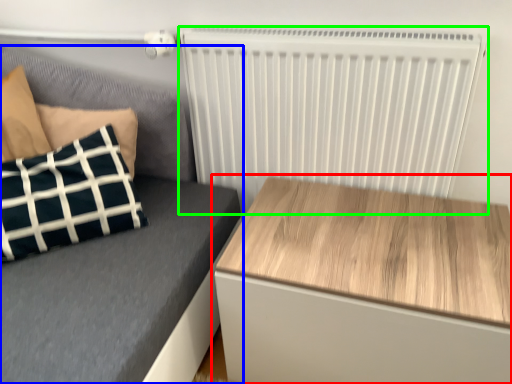
Question: Considering the real-world distances, which object is farthest from table (highlighted by a red box)? furniture (highlighted by a blue box) or radiator (highlighted by a green box)?

Choices:
 (A) furniture
 (B) radiator

Answer: (A)